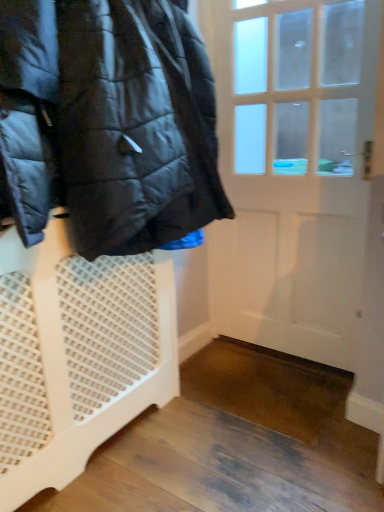
Question: Is white wooden door at center smaller than glossy black jacket at left?

Choices:
 (A) yes
 (B) no

Answer: (A)

Question: Is white wooden door at center far from glossy black jacket at left?

Choices:
 (A) yes
 (B) no

Answer: (B)

Question: From a real-world perspective, does white wooden door at center sit lower than glossy black jacket at left?

Choices:
 (A) yes
 (B) no

Answer: (A)

Question: Would you say white wooden door at center is outside glossy black jacket at left?

Choices:
 (A) no
 (B) yes

Answer: (B)

Question: From the image's perspective, would you say white wooden door at center is shown under glossy black jacket at left?

Choices:
 (A) no
 (B) yes

Answer: (B)

Question: Considering the relative sizes of white wooden door at center and glossy black jacket at left in the image provided, is white wooden door at center thinner than glossy black jacket at left?

Choices:
 (A) yes
 (B) no

Answer: (A)

Question: From a real-world perspective, is glossy black jacket at left over white wooden door at center?

Choices:
 (A) no
 (B) yes

Answer: (B)

Question: Is glossy black jacket at left behind white wooden door at center?

Choices:
 (A) no
 (B) yes

Answer: (A)

Question: Is glossy black jacket at left bigger than white wooden door at center?

Choices:
 (A) yes
 (B) no

Answer: (A)

Question: From a real-world perspective, is glossy black jacket at left located beneath white wooden door at center?

Choices:
 (A) yes
 (B) no

Answer: (B)

Question: Considering the relative sizes of glossy black jacket at left and white wooden door at center in the image provided, is glossy black jacket at left wider than white wooden door at center?

Choices:
 (A) no
 (B) yes

Answer: (B)

Question: Is glossy black jacket at left positioned beyond the bounds of white wooden door at center?

Choices:
 (A) yes
 (B) no

Answer: (A)

Question: Does white mesh laundry basket at left have a lesser width compared to glossy black jacket at left?

Choices:
 (A) yes
 (B) no

Answer: (A)